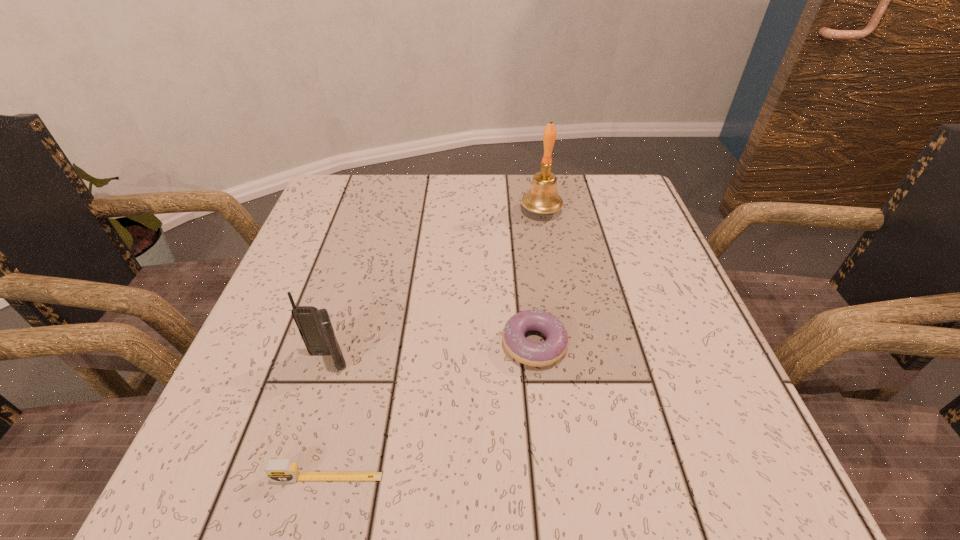
What are the coordinates of `cellular telephone present at the left edge` in the screenshot? It's located at (315, 327).

The image size is (960, 540). I want to click on tape measure at the left edge, so click(277, 470).

This screenshot has width=960, height=540. I want to click on object situated at the near left corner, so click(277, 470).

The height and width of the screenshot is (540, 960). I want to click on vacant area at the far edge, so click(x=393, y=193).

Locate an element on the screen. This screenshot has height=540, width=960. vacant position at the near edge of the desktop is located at coordinates (584, 453).

Find the location of `vacant space at the left edge of the desktop`. vacant space at the left edge of the desktop is located at coordinates (276, 370).

Locate an element on the screen. The height and width of the screenshot is (540, 960). vacant space at the right edge is located at coordinates (618, 347).

You are a GUI agent. You are given a task and a screenshot of the screen. Output one action in this format:
    pyautogui.click(x=<x>, y=<y>)
    Task: Click on the free location at the far left corner
    Image resolution: width=960 pixels, height=540 pixels.
    Given the screenshot: What is the action you would take?
    pyautogui.click(x=346, y=191)

Where is `vacant area at the far right corner of the desktop`? Image resolution: width=960 pixels, height=540 pixels. vacant area at the far right corner of the desktop is located at coordinates (593, 220).

Where is `vacant space that is in between the tallest object and the doughnut`? This screenshot has height=540, width=960. vacant space that is in between the tallest object and the doughnut is located at coordinates [538, 278].